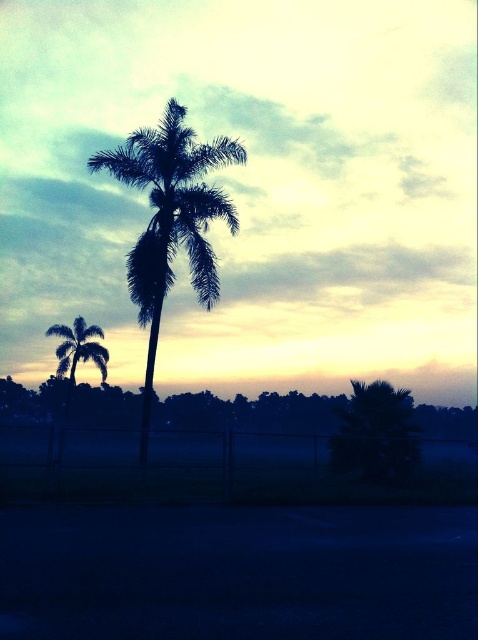
Does silhouette leafy palm at center appear on the left side of silhouette leafy palm at left?

In fact, silhouette leafy palm at center is to the right of silhouette leafy palm at left.

Is silhouette leafy palm at center closer to camera compared to silhouette leafy palm at left?

Yes, it is.

The width and height of the screenshot is (478, 640). What do you see at coordinates (171, 220) in the screenshot? I see `silhouette leafy palm at center` at bounding box center [171, 220].

I want to click on silhouette leafy palm at center, so click(171, 220).

Does green leafy palm at lower right have a lesser width compared to silhouette leafy palm at left?

Indeed, green leafy palm at lower right has a lesser width compared to silhouette leafy palm at left.

Between green leafy palm at lower right and silhouette leafy palm at left, which one appears on the right side from the viewer's perspective?

Positioned to the right is green leafy palm at lower right.

Is point (347, 408) positioned after point (84, 332)?

That is False.

Identify the location of green leafy palm at lower right. Image resolution: width=478 pixels, height=640 pixels. (376, 433).

Is silhouette leafy palm at center wider than green leafy palm at lower right?

Indeed, silhouette leafy palm at center has a greater width compared to green leafy palm at lower right.

Is silhouette leafy palm at center below green leafy palm at lower right?

No, silhouette leafy palm at center is not below green leafy palm at lower right.

At what (x,y) coordinates should I click in order to perform the action: click on silhouette leafy palm at center. Please return your answer as a coordinate pair (x, y). The height and width of the screenshot is (640, 478). Looking at the image, I should click on (171, 220).